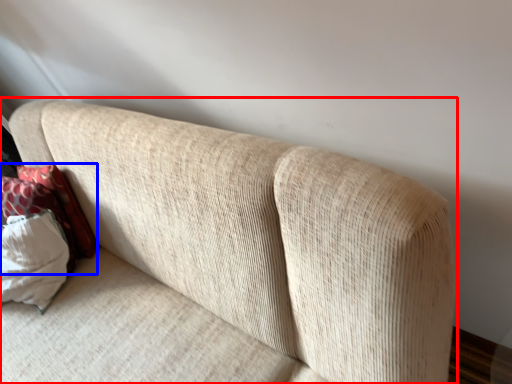
Question: Which object appears farthest to the camera in this image, studio couch (highlighted by a red box) or pillow (highlighted by a blue box)?

Choices:
 (A) studio couch
 (B) pillow

Answer: (B)